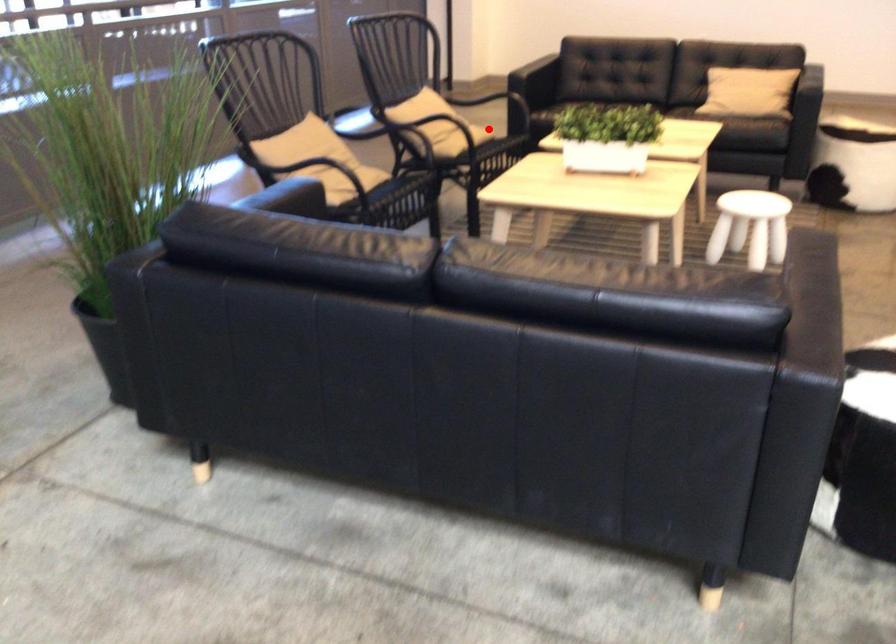
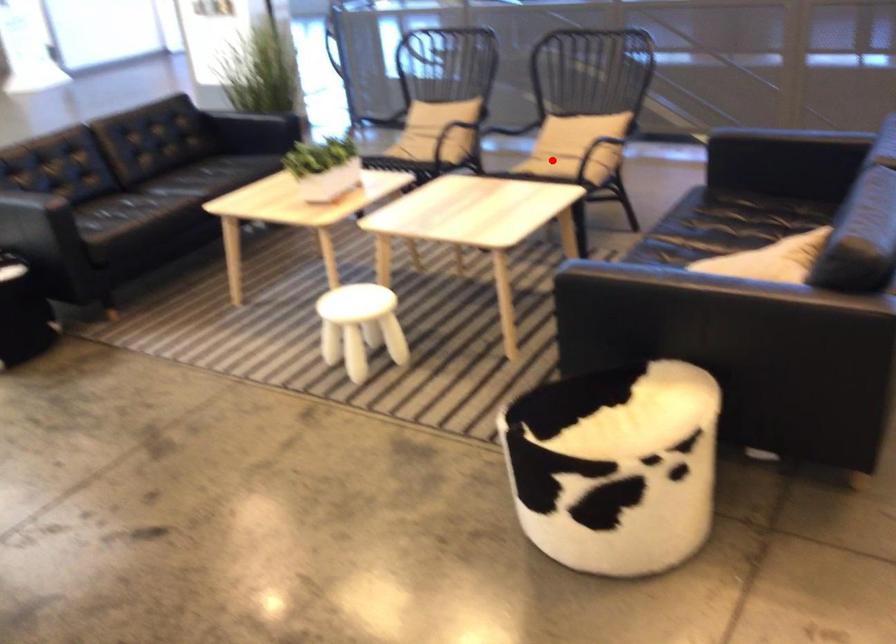
I am providing you with two images of the same scene from different viewpoints. A red point is marked on the first image and another point is marked on the second image. Does the point marked in image1 correspond to the same location as the one in image2?

Yes